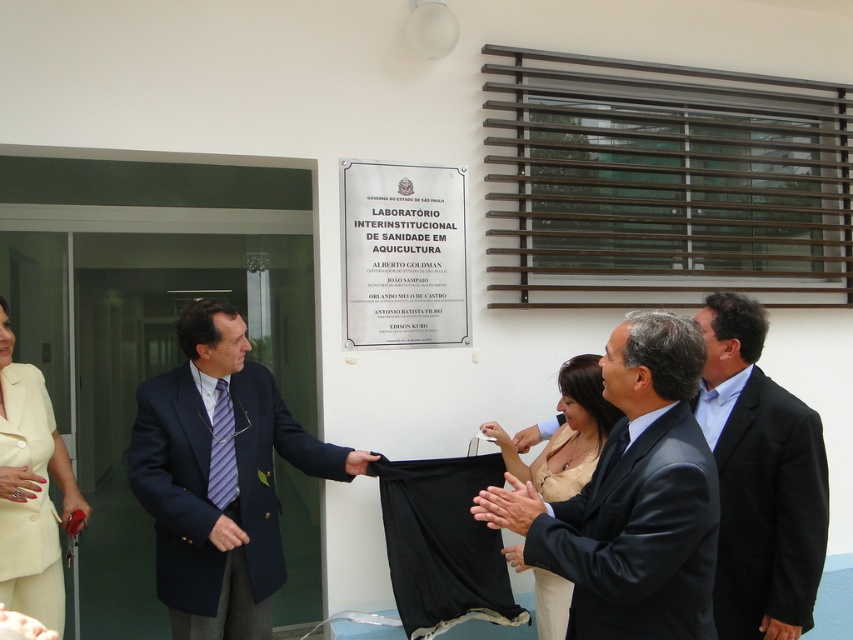
Question: Among these points, which one is farthest from the camera?

Choices:
 (A) (486, 433)
 (B) (637, 358)
 (C) (210, 500)

Answer: (A)

Question: Does black suit at center have a smaller size compared to matte cream suit at lower left?

Choices:
 (A) yes
 (B) no

Answer: (A)

Question: Can you confirm if matte cream suit at lower left is thinner than smooth skin hand at center?

Choices:
 (A) no
 (B) yes

Answer: (A)

Question: Is the position of dark gray suit at center less distant than that of navy blue suit at center?

Choices:
 (A) no
 (B) yes

Answer: (B)

Question: Which point is farther to the camera?

Choices:
 (A) (489, 438)
 (B) (222, 624)
 (C) (228, 493)

Answer: (A)

Question: Which point is farther to the camera?

Choices:
 (A) (235, 476)
 (B) (177, 509)
 (C) (659, 586)

Answer: (A)